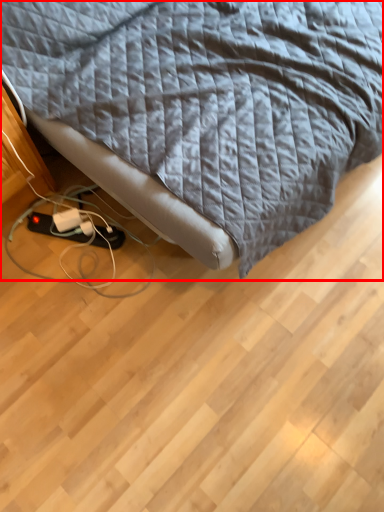
Question: From the image's perspective, considering the relative positions of bed (annotated by the red box) and extension cord in the image provided, where is bed (annotated by the red box) located with respect to the staircase?

Choices:
 (A) above
 (B) below

Answer: (A)